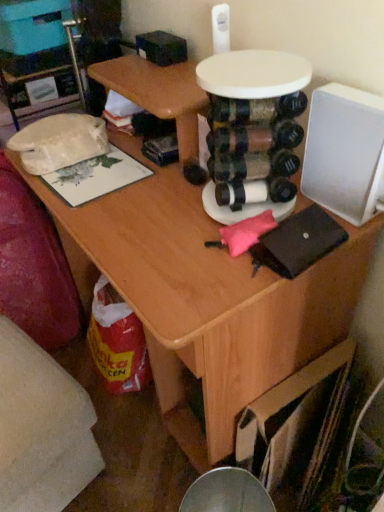
Question: From their relative heights in the image, would you say white fabric swivel chair at lower left is taller or shorter than white plastic round table at center?

Choices:
 (A) tall
 (B) short

Answer: (A)

Question: Which is correct: white fabric swivel chair at lower left is inside white plastic round table at center, or outside of it?

Choices:
 (A) outside
 (B) inside

Answer: (A)

Question: Would you say white fabric swivel chair at lower left is to the left or to the right of white plastic round table at center in the picture?

Choices:
 (A) left
 (B) right

Answer: (A)

Question: In terms of width, does white plastic round table at center look wider or thinner when compared to white fabric swivel chair at lower left?

Choices:
 (A) wide
 (B) thin

Answer: (B)

Question: Considering the positions of white plastic round table at center and white fabric swivel chair at lower left in the image, is white plastic round table at center bigger or smaller than white fabric swivel chair at lower left?

Choices:
 (A) big
 (B) small

Answer: (B)

Question: Is point (238, 79) positioned closer to the camera than point (28, 325)?

Choices:
 (A) closer
 (B) farther

Answer: (A)

Question: Considering the positions of white plastic round table at center and white fabric swivel chair at lower left in the image, is white plastic round table at center taller or shorter than white fabric swivel chair at lower left?

Choices:
 (A) short
 (B) tall

Answer: (A)